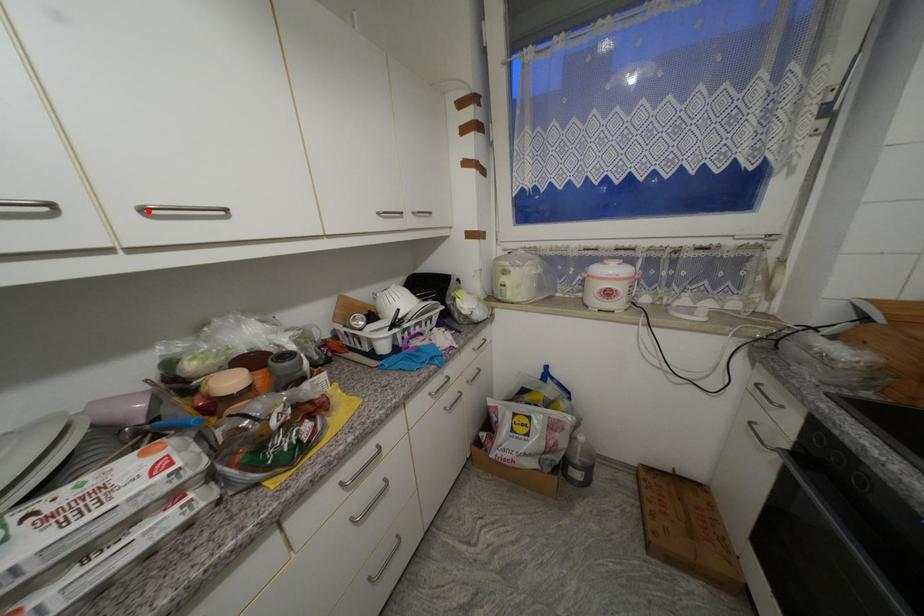
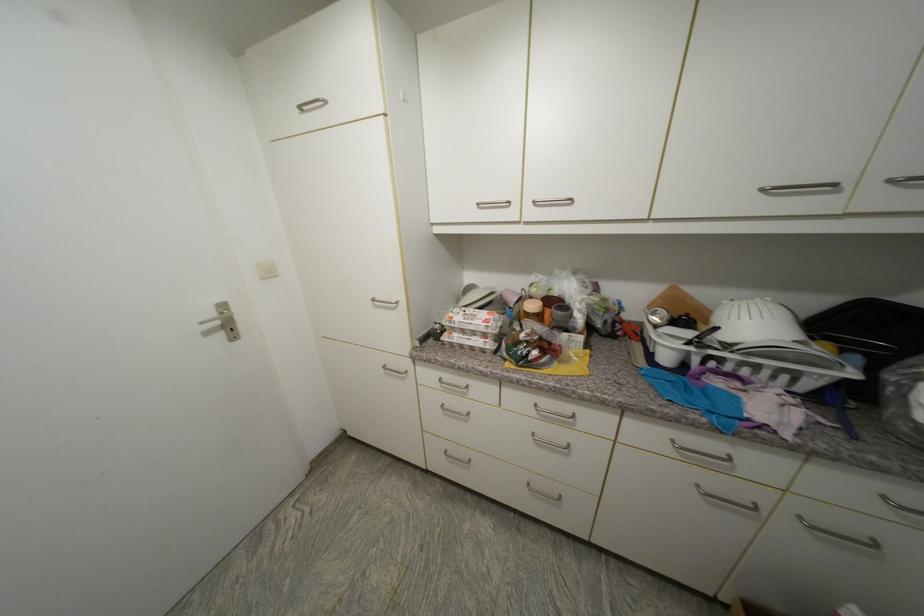
The point at the highlighted location is marked in the first image. Where is the corresponding point in the second image?

(540, 204)